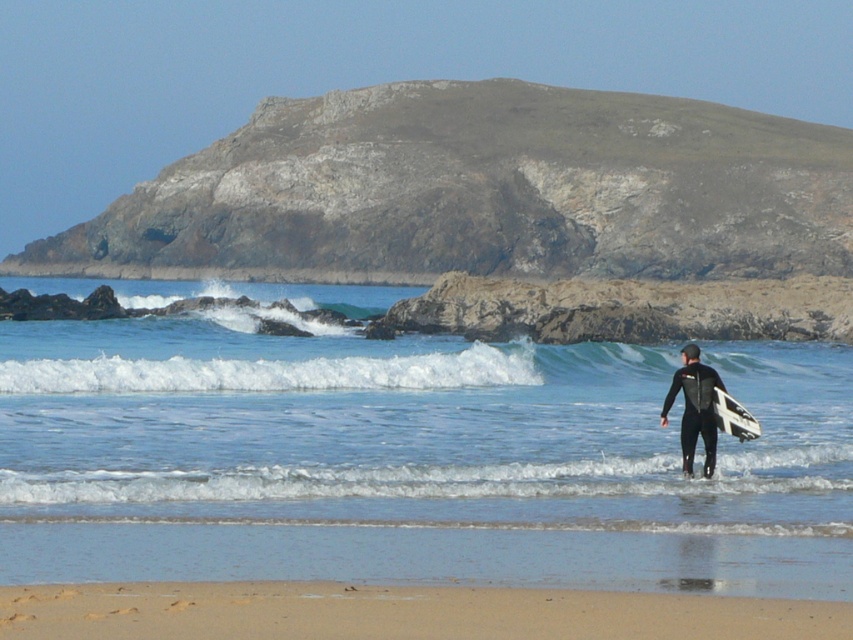
Does sandy beach at lower center have a greater width compared to black wetsuit at center?

Correct, the width of sandy beach at lower center exceeds that of black wetsuit at center.

Locate an element on the screen. sandy beach at lower center is located at coordinates (399, 612).

I want to click on sandy beach at lower center, so click(x=399, y=612).

Is clear blue water at center to the right of black wetsuit at center from the viewer's perspective?

In fact, clear blue water at center is to the left of black wetsuit at center.

Is point (564, 413) closer to camera compared to point (711, 449)?

No, it is not.

The image size is (853, 640). Identify the location of clear blue water at center. (405, 428).

Is point (526, 524) positioned in front of point (718, 417)?

Yes, point (526, 524) is in front of point (718, 417).

This screenshot has width=853, height=640. What do you see at coordinates (405, 428) in the screenshot?
I see `clear blue water at center` at bounding box center [405, 428].

Which is in front, point (817, 433) or point (729, 412)?

Positioned in front is point (729, 412).

I want to click on clear blue water at center, so click(405, 428).